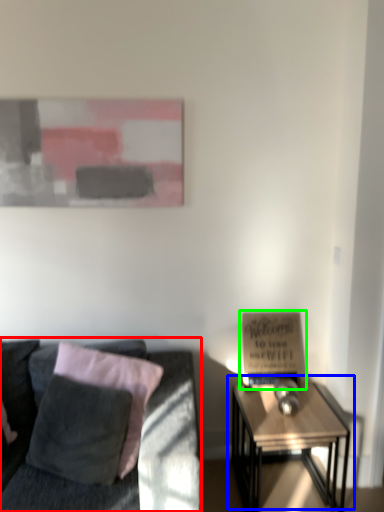
Question: Which object is the closest to the studio couch (highlighted by a red box)? Choose among these: table (highlighted by a blue box) or bulletin board (highlighted by a green box).

Choices:
 (A) table
 (B) bulletin board

Answer: (B)